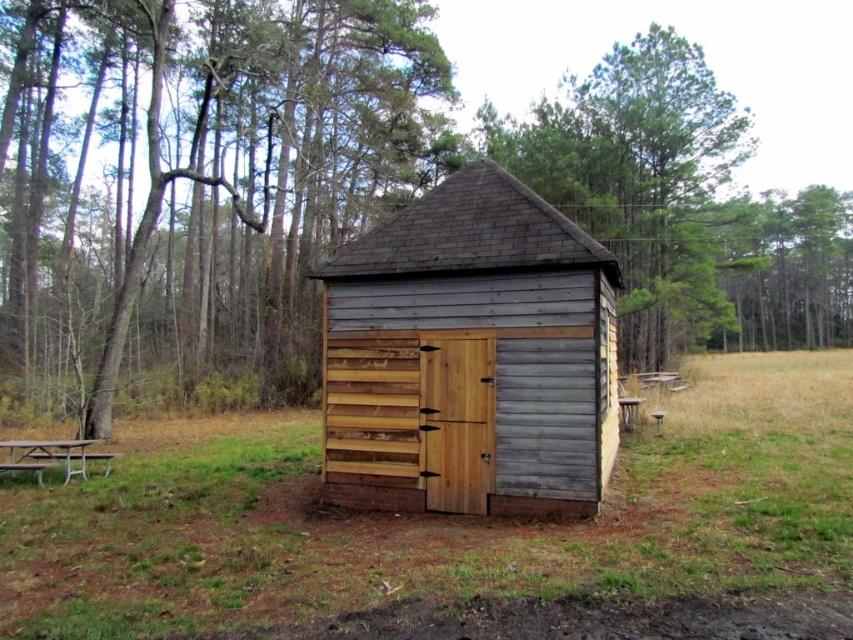
Is green grass at center below metallic silver picnic table at lower left?

Correct, green grass at center is located below metallic silver picnic table at lower left.

Which is below, green grass at center or metallic silver picnic table at lower left?

green grass at center

Who is more distant from viewer, (701, 589) or (12, 451)?

The point (12, 451) is more distant.

Where is `green grass at center`? The width and height of the screenshot is (853, 640). green grass at center is located at coordinates (440, 518).

Based on the photo, can you confirm if brown wood tree at center is smaller than weathered wood shed at center?

No.

Is brown wood tree at center wider than weathered wood shed at center?

Yes, brown wood tree at center is wider than weathered wood shed at center.

Image resolution: width=853 pixels, height=640 pixels. What are the coordinates of `brown wood tree at center` in the screenshot? It's located at (350, 193).

Locate an element on the screen. The image size is (853, 640). brown wood tree at center is located at coordinates (350, 193).

Is point (234, 122) less distant than point (796, 528)?

No, it is behind (796, 528).

Does brown wood tree at center have a lesser height compared to green grass at center?

No.

Is point (547, 124) farther from camera compared to point (419, 545)?

Yes.

You are a GUI agent. You are given a task and a screenshot of the screen. Output one action in this format:
    pyautogui.click(x=<x>, y=<y>)
    Task: Click on the brown wood tree at center
    The width and height of the screenshot is (853, 640).
    Given the screenshot: What is the action you would take?
    pyautogui.click(x=350, y=193)